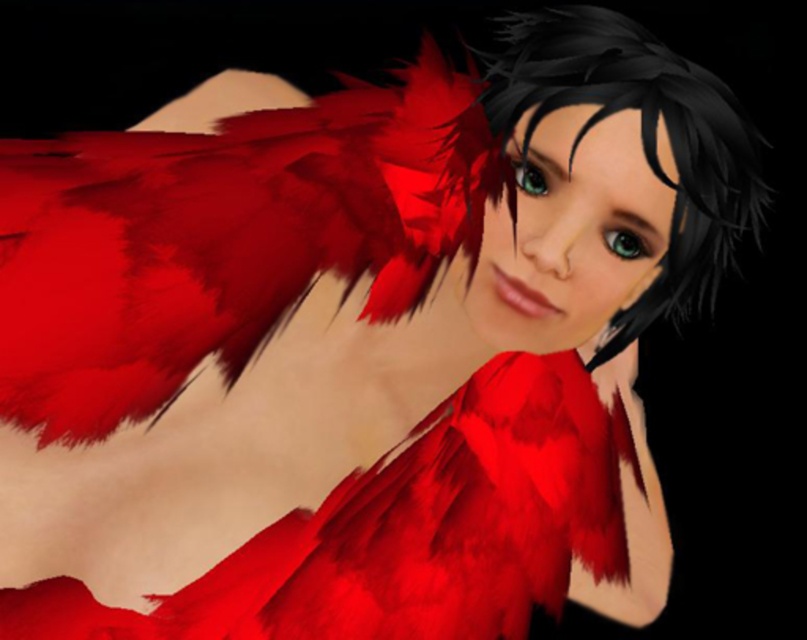
You are a photographer adjusting your camera settings to capture the character in the image. You notice two points on the character, one at point (586, 477) and the other at point (608, 333). Which point should you focus on to ensure it appears closer to the camera in the final photo?

Point (586, 477) is further to the camera than point (608, 333), so focusing on point (586, 477) will ensure it appears closer in the photo.